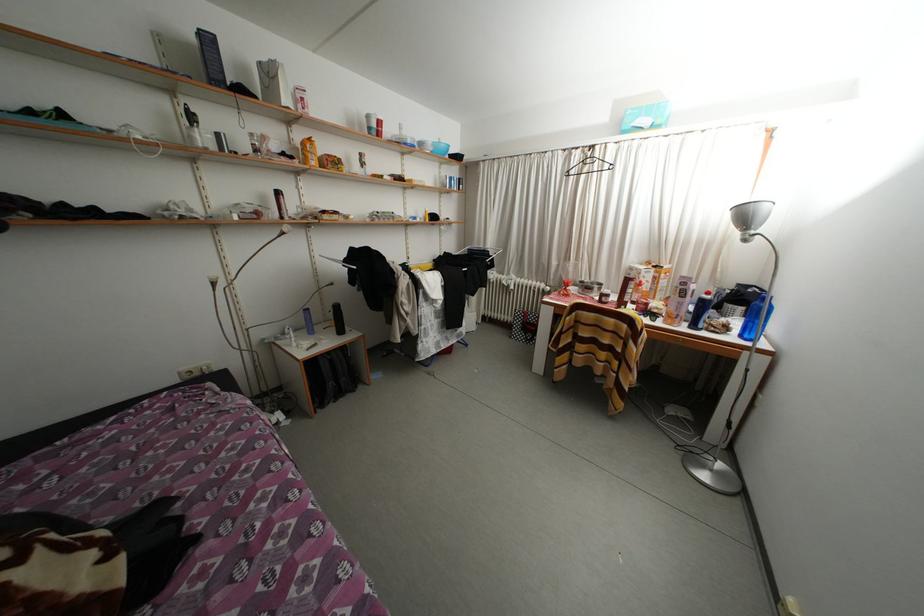
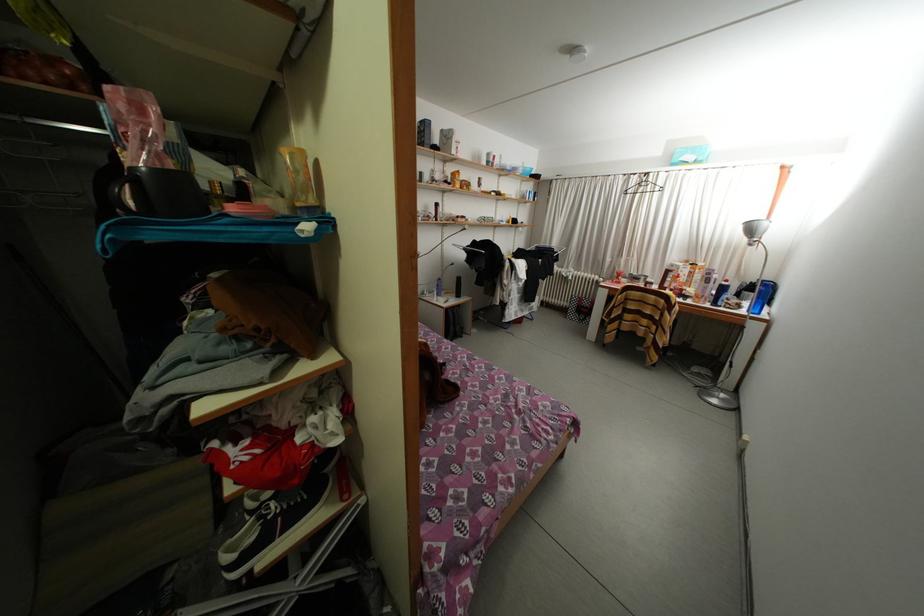
In the second image, find the point that corresponds to point (735, 333) in the first image.

(747, 310)